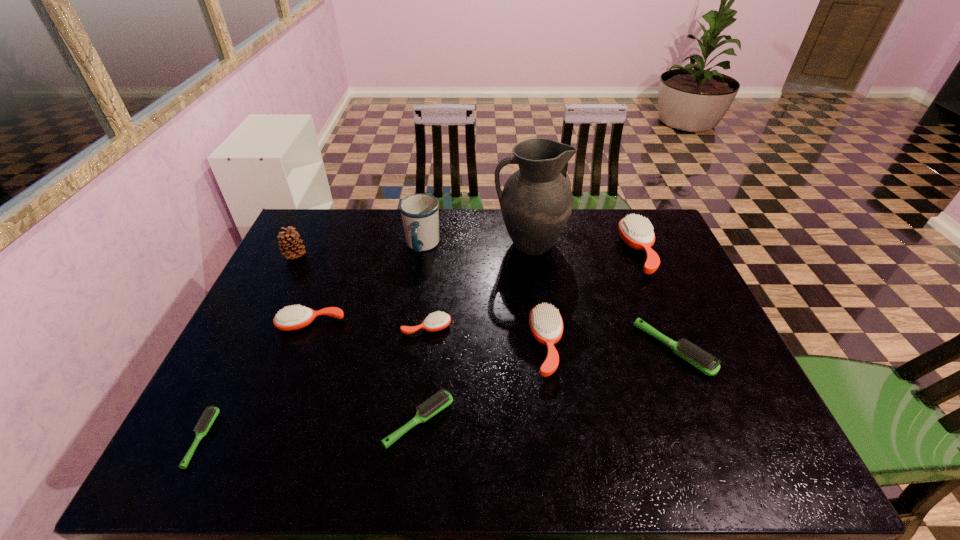
I want to click on empty space that is in between the second light hairbrush from left to right and the tallest object, so click(474, 333).

Locate an element on the screen. This screenshot has height=540, width=960. object that is the closest to the fifth tallest object is located at coordinates (704, 362).

This screenshot has height=540, width=960. Find the location of `object that is the fourth closest to the white mug`. object that is the fourth closest to the white mug is located at coordinates (288, 243).

Point out which hairbrush is positioned as the fifth nearest to the leftmost light hairbrush. Please provide its 2D coordinates. Your answer should be formatted as a tuple, i.e. [(x, y)], where the tuple contains the x and y coordinates of a point satisfying the conditions above.

[(704, 362)]

Identify which hairbrush is located as the sixth nearest to the second orange hairbrush from right to left. Please provide its 2D coordinates. Your answer should be formatted as a tuple, i.e. [(x, y)], where the tuple contains the x and y coordinates of a point satisfying the conditions above.

[(211, 413)]

I want to click on orange hairbrush that is the closest to the third object from left to right, so click(x=437, y=321).

Locate which orange hairbrush is the closest to the fifth shortest object. Please provide its 2D coordinates. Your answer should be formatted as a tuple, i.e. [(x, y)], where the tuple contains the x and y coordinates of a point satisfying the conditions above.

[(437, 321)]

The width and height of the screenshot is (960, 540). In order to click on light hairbrush that is the second closest to the mug in this screenshot , I will do `click(704, 362)`.

You are a GUI agent. You are given a task and a screenshot of the screen. Output one action in this format:
    pyautogui.click(x=<x>, y=<y>)
    Task: Click on the closest light hairbrush to the third hairbrush from right to left
    The image size is (960, 540).
    Given the screenshot: What is the action you would take?
    pyautogui.click(x=704, y=362)

Where is `free location that satisfies the following two spatial constraints: 1. on the handle side of the ninth tallest object; 2. on the right side of the ninth shortest object`? free location that satisfies the following two spatial constraints: 1. on the handle side of the ninth tallest object; 2. on the right side of the ninth shortest object is located at coordinates (395, 421).